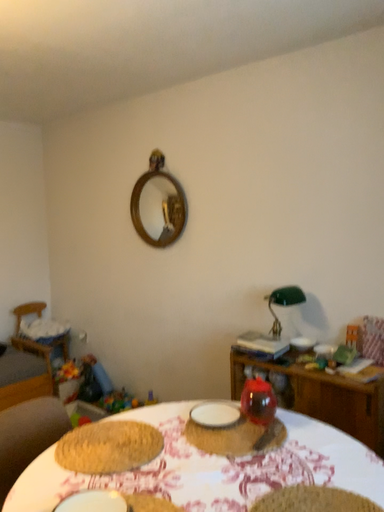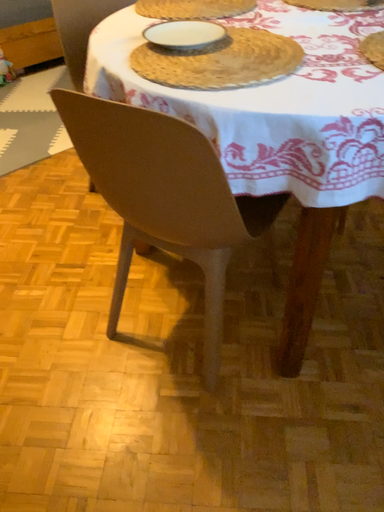
Question: How did the camera likely rotate when shooting the video?

Choices:
 (A) rotated right
 (B) rotated left

Answer: (B)